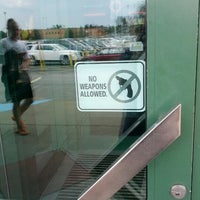
Find the location of `glass in door`. glass in door is located at coordinates (73, 127).